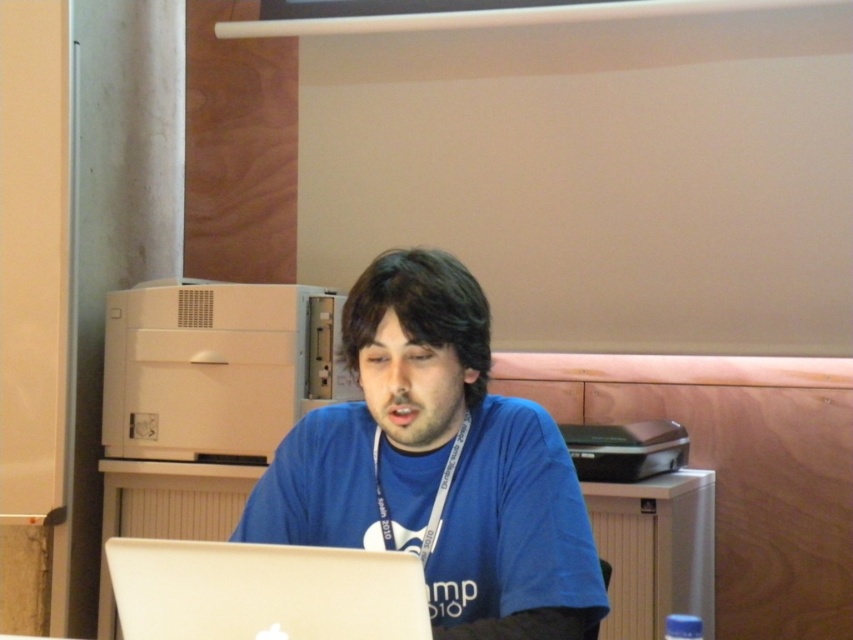
Does blue fabric shirt at center have a smaller size compared to silver metallic laptop at lower center?

No.

Does blue fabric shirt at center have a greater width compared to silver metallic laptop at lower center?

Yes.

Which is behind, point (520, 449) or point (125, 609)?

The point (520, 449) is more distant.

At what (x,y) coordinates should I click in order to perform the action: click on blue fabric shirt at center. Please return your answer as a coordinate pair (x, y). Looking at the image, I should click on (437, 465).